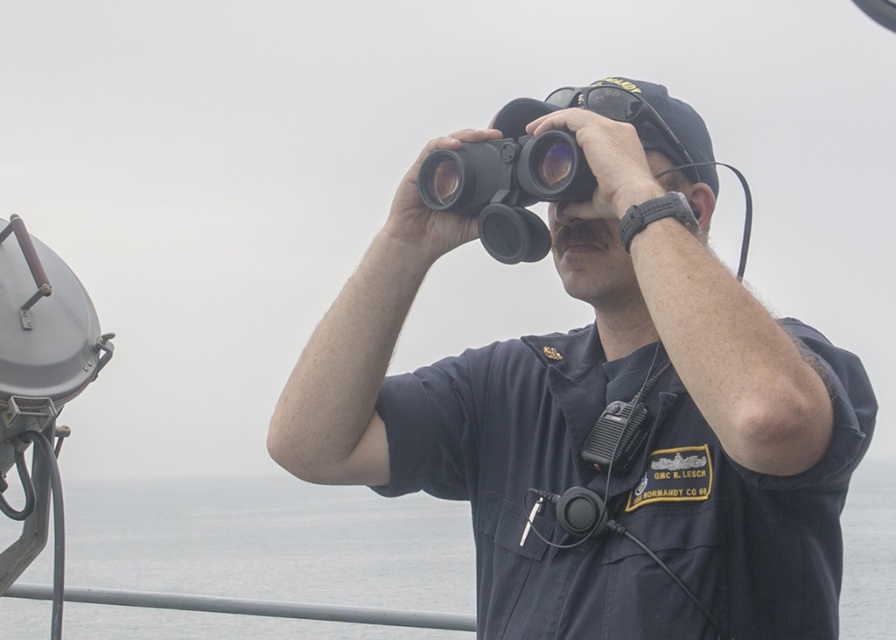
Question: Which point is closer to the camera?

Choices:
 (A) (840, 401)
 (B) (294, 634)

Answer: (A)

Question: Is black matte binoculars at center to the right of gray water at center from the viewer's perspective?

Choices:
 (A) no
 (B) yes

Answer: (B)

Question: Is black matte binoculars at center to the left of gray water at center from the viewer's perspective?

Choices:
 (A) yes
 (B) no

Answer: (B)

Question: Observing the image, what is the correct spatial positioning of black matte binoculars at center in reference to gray water at center?

Choices:
 (A) above
 (B) below

Answer: (A)

Question: Which point is farther to the camera?

Choices:
 (A) black matte binoculars at center
 (B) gray water at center

Answer: (B)